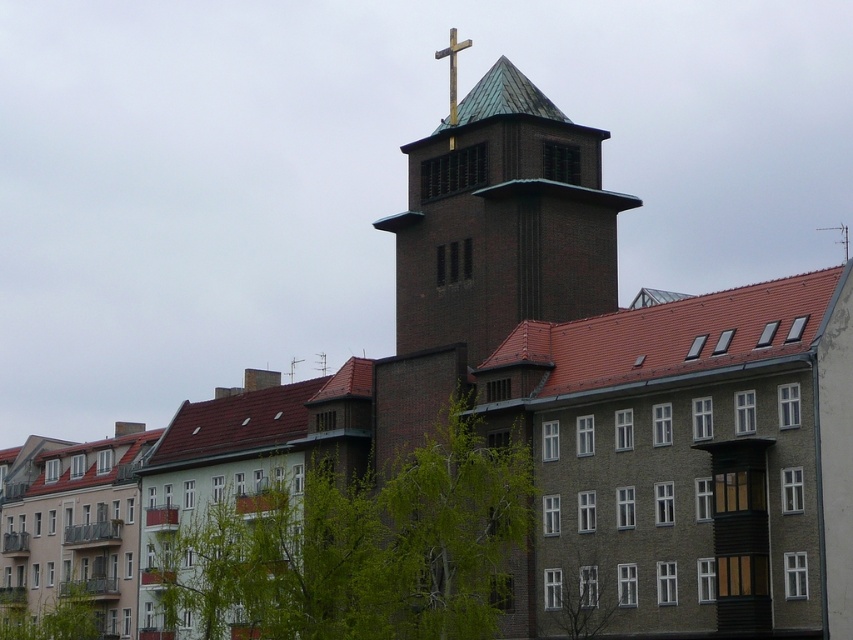
You are an architect reviewing a building design. You notice the brown brick tower at center and the gold metallic cross at upper center. Based on the provided design, which object occupies a larger area in the image?

The gold metallic cross at upper center has a larger size than the brown brick tower at center, so it occupies a larger area in the image.

You are standing in front of the building and want to locate the brown brick tower at center. What are the coordinates of its position?

The brown brick tower at center is located at coordinates (x=502, y=221).